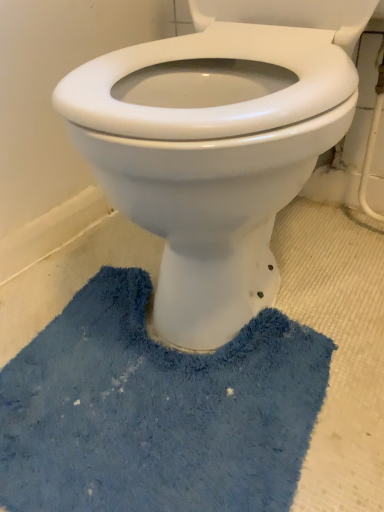
Measure the distance between point (319,376) and camera.

Point (319,376) is 26.02 inches from camera.

This screenshot has width=384, height=512. What do you see at coordinates (156, 411) in the screenshot?
I see `blue fuzzy bath mat at lower center` at bounding box center [156, 411].

This screenshot has height=512, width=384. I want to click on blue fuzzy bath mat at lower center, so click(156, 411).

Describe the element at coordinates (212, 165) in the screenshot. This screenshot has height=512, width=384. I see `white glossy toilet at center` at that location.

Identify the location of white glossy toilet at center. (212, 165).

At what (x,y) coordinates should I click in order to perform the action: click on blue fuzzy bath mat at lower center. Please return your answer as a coordinate pair (x, y). The height and width of the screenshot is (512, 384). Looking at the image, I should click on (156, 411).

Between blue fuzzy bath mat at lower center and white glossy toilet at center, which one appears on the right side from the viewer's perspective?

white glossy toilet at center.

Which object is more forward, blue fuzzy bath mat at lower center or white glossy toilet at center?

white glossy toilet at center is in front.

Between point (65, 432) and point (216, 310), which one is positioned in front?

Point (65, 432)

From the image's perspective, is blue fuzzy bath mat at lower center above or below white glossy toilet at center?

Clearly, from the image's perspective, blue fuzzy bath mat at lower center is below white glossy toilet at center.

From a real-world perspective, which is physically below, blue fuzzy bath mat at lower center or white glossy toilet at center?

In real-world perspective, blue fuzzy bath mat at lower center is lower.

In terms of width, does blue fuzzy bath mat at lower center look wider or thinner when compared to white glossy toilet at center?

Considering their sizes, blue fuzzy bath mat at lower center looks slimmer than white glossy toilet at center.

From their relative heights in the image, would you say blue fuzzy bath mat at lower center is taller or shorter than white glossy toilet at center?

Considering their sizes, blue fuzzy bath mat at lower center has less height than white glossy toilet at center.

Considering the relative sizes of blue fuzzy bath mat at lower center and white glossy toilet at center in the image provided, is blue fuzzy bath mat at lower center bigger than white glossy toilet at center?

No, blue fuzzy bath mat at lower center is not bigger than white glossy toilet at center.

Which is correct: blue fuzzy bath mat at lower center is inside white glossy toilet at center, or outside of it?

blue fuzzy bath mat at lower center is outside white glossy toilet at center.

Are blue fuzzy bath mat at lower center and white glossy toilet at center located far from each other?

No, there isn't a large distance between blue fuzzy bath mat at lower center and white glossy toilet at center.

Is blue fuzzy bath mat at lower center oriented away from white glossy toilet at center?

That's not correct — blue fuzzy bath mat at lower center is not looking away from white glossy toilet at center.

How many degrees apart are the facing directions of blue fuzzy bath mat at lower center and white glossy toilet at center?

6.98 degrees separate the facing orientations of blue fuzzy bath mat at lower center and white glossy toilet at center.

Locate an element on the screen. Image resolution: width=384 pixels, height=512 pixels. bidet on the right of the blue fuzzy bath mat at lower center is located at coordinates (212, 165).

Which is more to the right, white glossy toilet at center or blue fuzzy bath mat at lower center?

From the viewer's perspective, white glossy toilet at center appears more on the right side.

Considering the positions of objects white glossy toilet at center and blue fuzzy bath mat at lower center in the image provided, who is in front, white glossy toilet at center or blue fuzzy bath mat at lower center?

Positioned in front is white glossy toilet at center.

Does point (308, 40) lie behind point (285, 412)?

Yes, point (308, 40) is farther from viewer.

Based on the photo, from the image's perspective, does white glossy toilet at center appear higher than blue fuzzy bath mat at lower center?

Yes, from the image's perspective, white glossy toilet at center is on top of blue fuzzy bath mat at lower center.

From a real-world perspective, is white glossy toilet at center physically located above or below blue fuzzy bath mat at lower center?

white glossy toilet at center is situated higher than blue fuzzy bath mat at lower center in the real world.

Between white glossy toilet at center and blue fuzzy bath mat at lower center, which one has smaller width?

Thinner between the two is blue fuzzy bath mat at lower center.

Considering the sizes of objects white glossy toilet at center and blue fuzzy bath mat at lower center in the image provided, who is taller, white glossy toilet at center or blue fuzzy bath mat at lower center?

Standing taller between the two is white glossy toilet at center.

Which of these two, white glossy toilet at center or blue fuzzy bath mat at lower center, is bigger?

white glossy toilet at center is bigger.

Can we say white glossy toilet at center lies outside blue fuzzy bath mat at lower center?

Indeed, white glossy toilet at center is completely outside blue fuzzy bath mat at lower center.

Is white glossy toilet at center not near blue fuzzy bath mat at lower center?

white glossy toilet at center is actually quite close to blue fuzzy bath mat at lower center.

Is white glossy toilet at center oriented away from blue fuzzy bath mat at lower center?

No, blue fuzzy bath mat at lower center is not at the back of white glossy toilet at center.

How different are the orientations of white glossy toilet at center and blue fuzzy bath mat at lower center in degrees?

The facing directions of white glossy toilet at center and blue fuzzy bath mat at lower center are 6.98 degrees apart.

Locate an element on the screen. Image resolution: width=384 pixels, height=512 pixels. bath mat that is below the white glossy toilet at center (from the image's perspective) is located at coordinates point(156,411).

Image resolution: width=384 pixels, height=512 pixels. In the image, there is a white glossy toilet at center. In order to click on bath mat below it (from the image's perspective) in this screenshot , I will do `click(156, 411)`.

Find the location of a particular element. This screenshot has width=384, height=512. bidet lying above the blue fuzzy bath mat at lower center (from the image's perspective) is located at coordinates (212, 165).